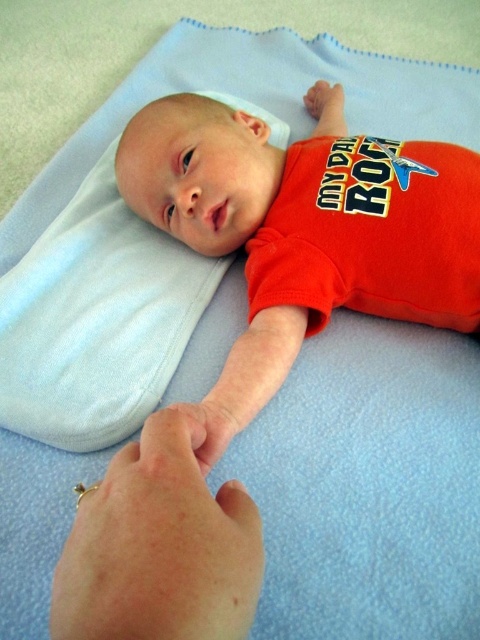
Based on the scene description, where is the matte orange shirt at center located?

The matte orange shirt at center is located at point 0.361 in the x coordinate and 0.635 in the y coordinate.